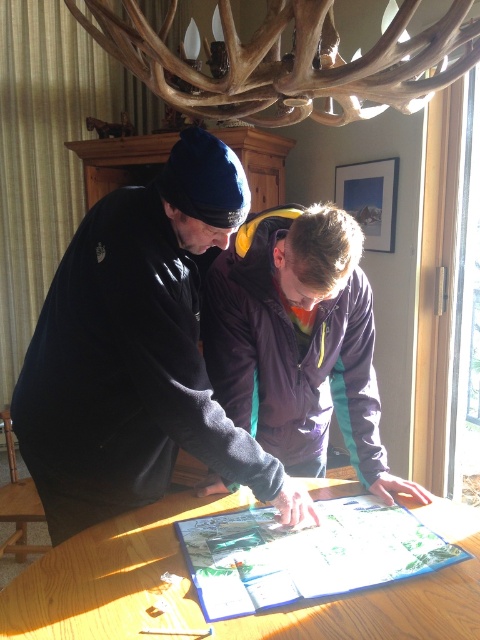
You are standing in the room and want to place a small plant exactly at the center of the table where the dark blue fleece jacket at center is located. What are the coordinates where you should place the plant?

The coordinates for placing the plant should be at point (x=136, y=353), which is where the dark blue fleece jacket at center is positioned.

You are a photographer trying to capture a candid shot of both the dark blue fleece jacket at center and the purple fleece jacket at center. Since the window on the right is letting in a lot of light, where should you position yourself to ensure both jackets are well lit?

The photographer should position themselves to the left of the subjects because the window is on the right, and the dark blue fleece jacket at center is above the purple fleece jacket at center, so positioning to the left would ensure both jackets receive balanced lighting from the window.